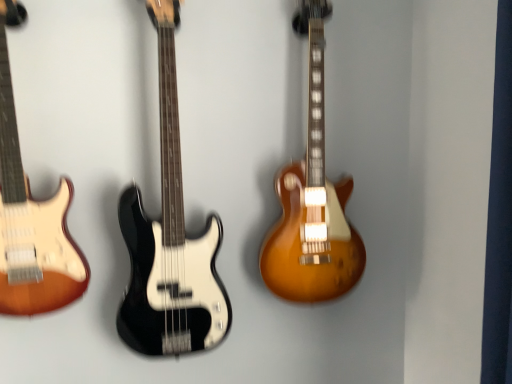
Question: Could you tell me if satin sunburst electric guitar at center, which ranks as the 1th guitar in right-to-left order, is turned towards sunburst wood electric guitar at left, marked as the 1th guitar in a left-to-right arrangement?

Choices:
 (A) no
 (B) yes

Answer: (A)

Question: Is satin sunburst electric guitar at center, which ranks as the 1th guitar in right-to-left order, shorter than sunburst wood electric guitar at left, acting as the 3th guitar starting from the right?

Choices:
 (A) no
 (B) yes

Answer: (A)

Question: Is satin sunburst electric guitar at center, which ranks as the 1th guitar in right-to-left order, closer to camera compared to sunburst wood electric guitar at left, acting as the 3th guitar starting from the right?

Choices:
 (A) yes
 (B) no

Answer: (B)

Question: Considering the relative sizes of satin sunburst electric guitar at center, the third guitar when ordered from left to right, and sunburst wood electric guitar at left, acting as the 3th guitar starting from the right, in the image provided, is satin sunburst electric guitar at center, the third guitar when ordered from left to right, wider than sunburst wood electric guitar at left, acting as the 3th guitar starting from the right,?

Choices:
 (A) yes
 (B) no

Answer: (A)

Question: From the image's perspective, is satin sunburst electric guitar at center, which ranks as the 1th guitar in right-to-left order, above sunburst wood electric guitar at left, acting as the 3th guitar starting from the right?

Choices:
 (A) no
 (B) yes

Answer: (B)

Question: Considering the relative positions of black glossy bass guitar at center, which is the second guitar in left-to-right order, and satin sunburst electric guitar at center, which ranks as the 1th guitar in right-to-left order, in the image provided, is black glossy bass guitar at center, which is the second guitar in left-to-right order, to the left or to the right of satin sunburst electric guitar at center, which ranks as the 1th guitar in right-to-left order,?

Choices:
 (A) right
 (B) left

Answer: (B)

Question: Is point (158, 271) closer or farther from the camera than point (307, 11)?

Choices:
 (A) farther
 (B) closer

Answer: (A)

Question: Considering their positions, is black glossy bass guitar at center, positioned as the 2th guitar in right-to-left order, located in front of or behind satin sunburst electric guitar at center, which ranks as the 1th guitar in right-to-left order?

Choices:
 (A) front
 (B) behind

Answer: (A)

Question: Considering the positions of black glossy bass guitar at center, which is the second guitar in left-to-right order, and satin sunburst electric guitar at center, the third guitar when ordered from left to right, in the image, is black glossy bass guitar at center, which is the second guitar in left-to-right order, bigger or smaller than satin sunburst electric guitar at center, the third guitar when ordered from left to right,?

Choices:
 (A) small
 (B) big

Answer: (B)

Question: Is satin sunburst electric guitar at center, the third guitar when ordered from left to right, taller or shorter than sunburst wood electric guitar at left, acting as the 3th guitar starting from the right?

Choices:
 (A) tall
 (B) short

Answer: (A)

Question: Considering their positions, is satin sunburst electric guitar at center, which ranks as the 1th guitar in right-to-left order, located in front of or behind sunburst wood electric guitar at left, acting as the 3th guitar starting from the right?

Choices:
 (A) front
 (B) behind

Answer: (B)

Question: From a real-world perspective, relative to sunburst wood electric guitar at left, marked as the 1th guitar in a left-to-right arrangement, is satin sunburst electric guitar at center, which ranks as the 1th guitar in right-to-left order, vertically above or below?

Choices:
 (A) above
 (B) below

Answer: (B)

Question: From the image's perspective, is satin sunburst electric guitar at center, the third guitar when ordered from left to right, above or below sunburst wood electric guitar at left, acting as the 3th guitar starting from the right?

Choices:
 (A) below
 (B) above

Answer: (B)

Question: Based on their sizes in the image, would you say satin sunburst electric guitar at center, which ranks as the 1th guitar in right-to-left order, is bigger or smaller than black glossy bass guitar at center, positioned as the 2th guitar in right-to-left order?

Choices:
 (A) small
 (B) big

Answer: (A)

Question: Is satin sunburst electric guitar at center, the third guitar when ordered from left to right, inside the boundaries of black glossy bass guitar at center, which is the second guitar in left-to-right order, or outside?

Choices:
 (A) outside
 (B) inside

Answer: (A)